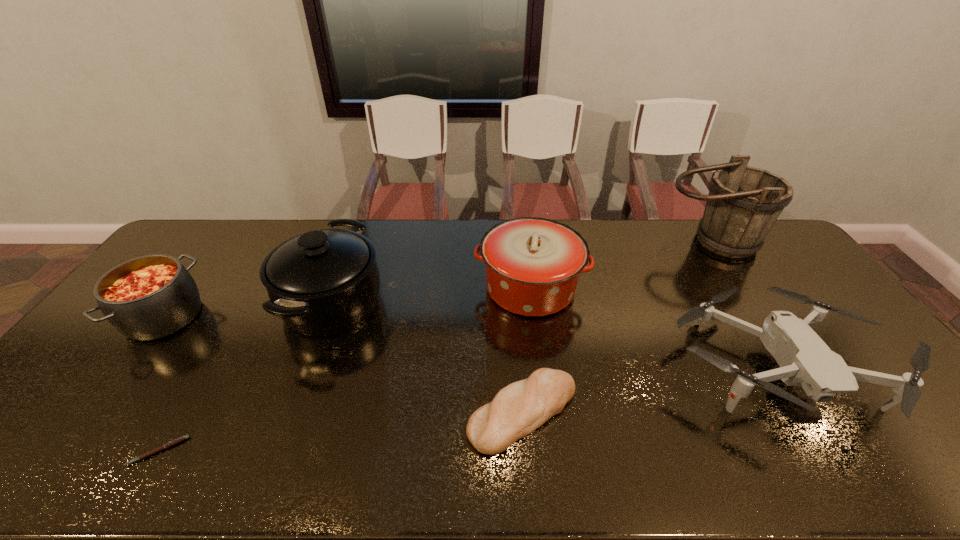
Image resolution: width=960 pixels, height=540 pixels. Find the location of `bucket`. bucket is located at coordinates (743, 204).

Image resolution: width=960 pixels, height=540 pixels. I want to click on the third object from left to right, so click(324, 282).

Identify the location of saucepan. (324, 282).

The image size is (960, 540). I want to click on the taller casserole, so click(533, 264).

Identify the location of the third tallest object. Image resolution: width=960 pixels, height=540 pixels. (533, 264).

Where is `the leftmost object`? the leftmost object is located at coordinates pos(149,297).

What are the coordinates of `the shorter casserole` in the screenshot? It's located at (149, 297).

Find the location of a particular element. The width and height of the screenshot is (960, 540). drone is located at coordinates (x=805, y=360).

Where is `bread`? The image size is (960, 540). bread is located at coordinates (518, 409).

The image size is (960, 540). Identify the location of the second object from left to right. (180, 439).